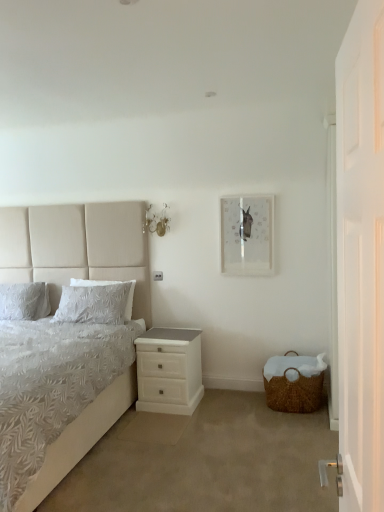
Where is `vacant space in between white glossy nightstand at lower center and woven brown basket at lower right`? vacant space in between white glossy nightstand at lower center and woven brown basket at lower right is located at coordinates (228, 402).